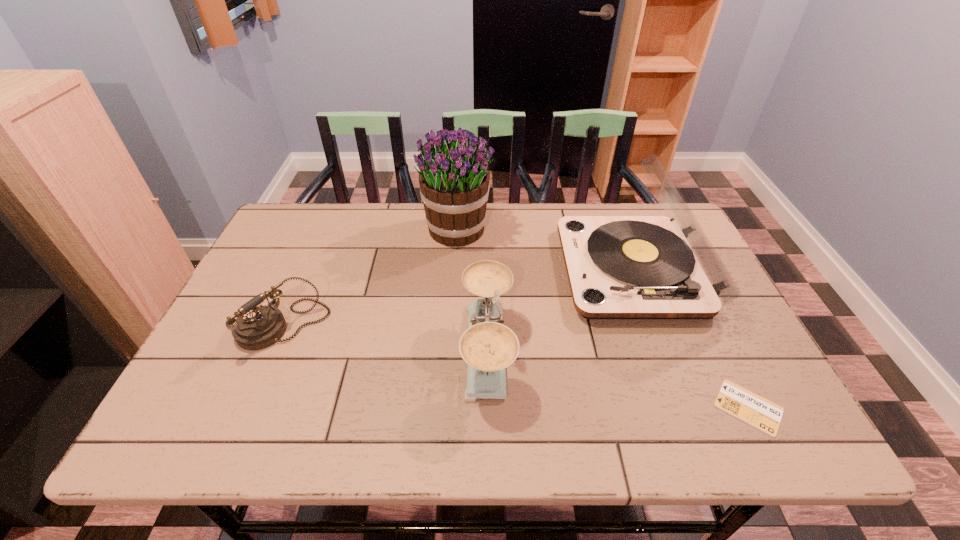
Locate an element on the screen. The image size is (960, 540). vacant region that satisfies the following two spatial constraints: 1. with the tonearm facing the front of the shortest object; 2. on the right side of the record player is located at coordinates (685, 407).

You are a GUI agent. You are given a task and a screenshot of the screen. Output one action in this format:
    pyautogui.click(x=<x>, y=<y>)
    Task: Click on the free point that satisfies the following two spatial constraints: 1. on the front-facing side of the shortest object; 2. on the left side of the scale
    This screenshot has height=540, width=960.
    Given the screenshot: What is the action you would take?
    489,407

The image size is (960, 540). In order to click on vacant area in the image that satisfies the following two spatial constraints: 1. on the front-facing side of the identity card; 2. on the left side of the third tallest object in this screenshot , I will do `click(489, 407)`.

At what (x,y) coordinates should I click in order to perform the action: click on vacant position in the image that satisfies the following two spatial constraints: 1. with the tonearm facing the front of the record player; 2. on the back side of the shortest object. Please return your answer as a coordinate pair (x, y). The height and width of the screenshot is (540, 960). Looking at the image, I should click on (685, 407).